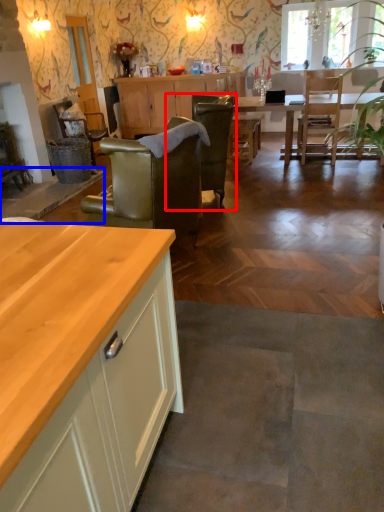
Question: Among these objects, which one is farthest to the camera, chair (highlighted by a red box) or counter (highlighted by a blue box)?

Choices:
 (A) chair
 (B) counter

Answer: (B)